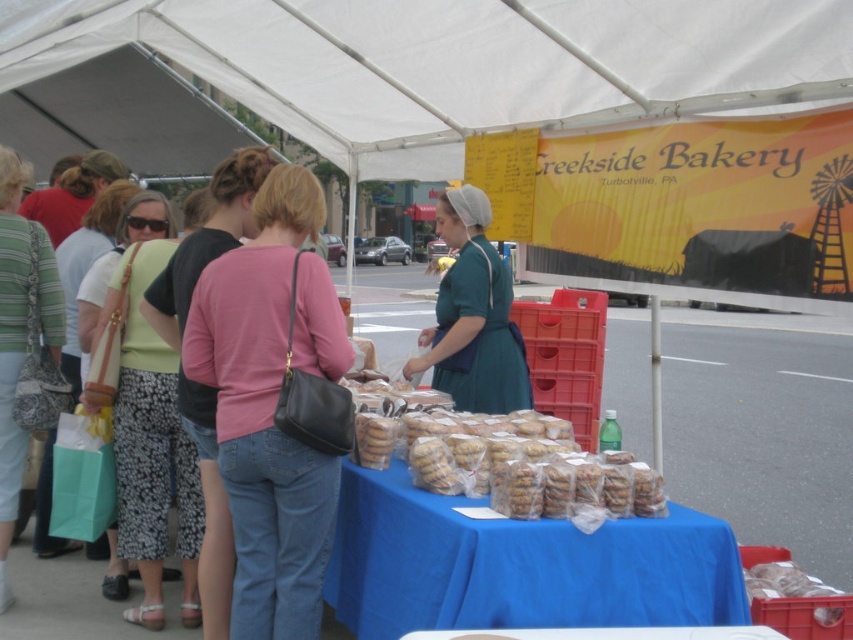
What do you see at coordinates (456, 61) in the screenshot? I see `white fabric canopy at upper center` at bounding box center [456, 61].

Measure the distance from white fabric canopy at upper center to translucent plastic cookies at center.

white fabric canopy at upper center is 2.06 meters from translucent plastic cookies at center.

Who is more distant from viewer, (578, 1) or (461, 449)?

The point (578, 1) is behind.

Where is `white fabric canopy at upper center`? This screenshot has height=640, width=853. white fabric canopy at upper center is located at coordinates (456, 61).

Is white fabric canopy at upper center shorter than teal fabric dress at center?

In fact, white fabric canopy at upper center may be taller than teal fabric dress at center.

Based on the photo, between white fabric canopy at upper center and teal fabric dress at center, which one is positioned lower?

teal fabric dress at center is lower down.

What are the coordinates of `white fabric canopy at upper center` in the screenshot? It's located at (456, 61).

How far apart are pink leather purse at center and light green fabric skirt at left?

pink leather purse at center is 30.67 inches away from light green fabric skirt at left.

Who is taller, pink leather purse at center or light green fabric skirt at left?

light green fabric skirt at left is taller.

Between point (241, 618) and point (131, 371), which one is positioned in front?

Point (241, 618) is in front.

Where is `pink leather purse at center`? pink leather purse at center is located at coordinates (271, 404).